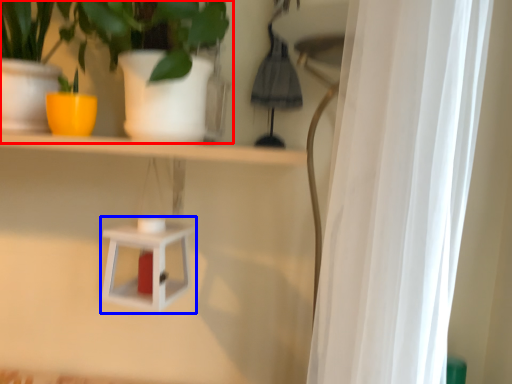
Question: Among these objects, which one is farthest to the camera, houseplant (highlighted by a red box) or shelf (highlighted by a blue box)?

Choices:
 (A) houseplant
 (B) shelf

Answer: (B)